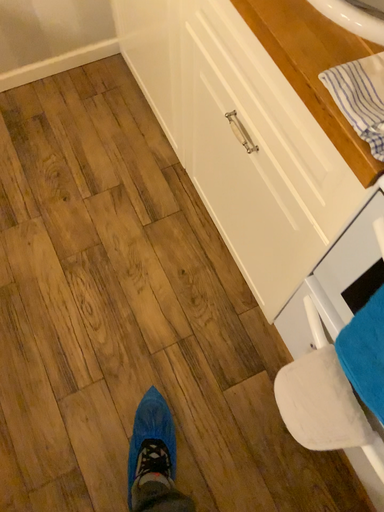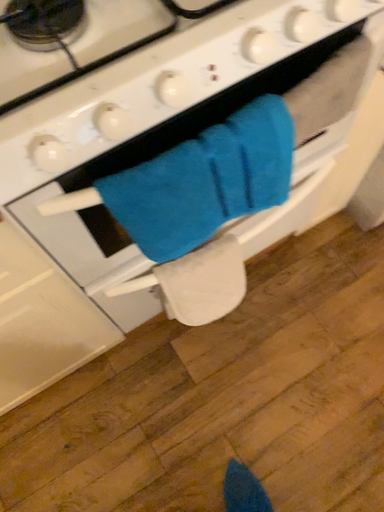
Question: Which way did the camera rotate in the video?

Choices:
 (A) rotated left
 (B) rotated right

Answer: (B)